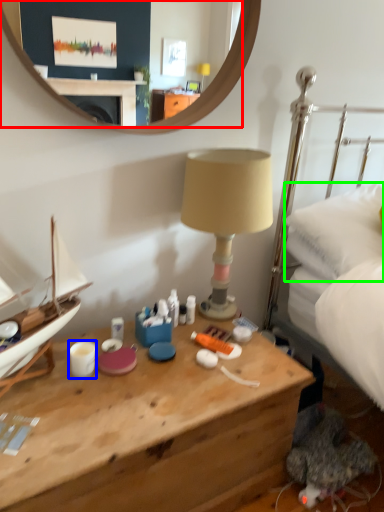
Question: Estimate the real-world distances between objects in this image. Which object is farther from mirror (highlighted by a red box), coffee cup (highlighted by a blue box) or pillow (highlighted by a green box)?

Choices:
 (A) coffee cup
 (B) pillow

Answer: (A)